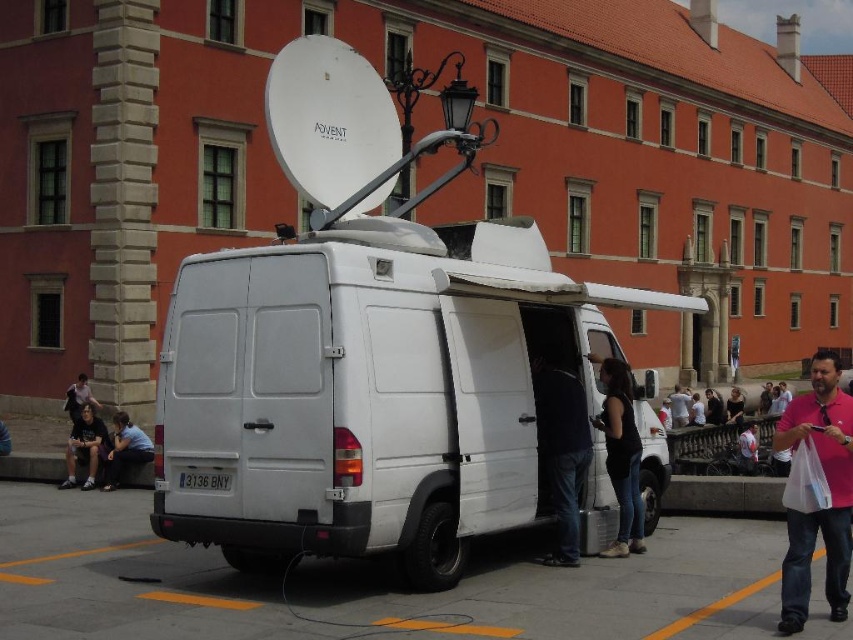
You are a security guard at the building and notice a person wearing a black matte tank top at center and dark blue jeans at lower left. Based on their clothing, where is the person positioned relative to the van?

The black matte tank top at center is to the right of the dark blue jeans at lower left, so the person is positioned to the right side of the van.

You are a photographer trying to capture both the matte black jacket at upper left and the smooth white shirt at center in one frame. Which of the two clothing items would require you to zoom in more to ensure it appears clearly in the photo?

The matte black jacket at upper left has a smaller size compared to the smooth white shirt at center, so you would need to zoom in more on the matte black jacket at upper left to ensure it appears clearly in the photo.

You are standing in front of the van and need to locate the black matte tank top at center. Based on the coordinates given, where would you look relative to the van?

The black matte tank top at center is located at coordinates point [621,454], which would be towards the lower central area of the van.